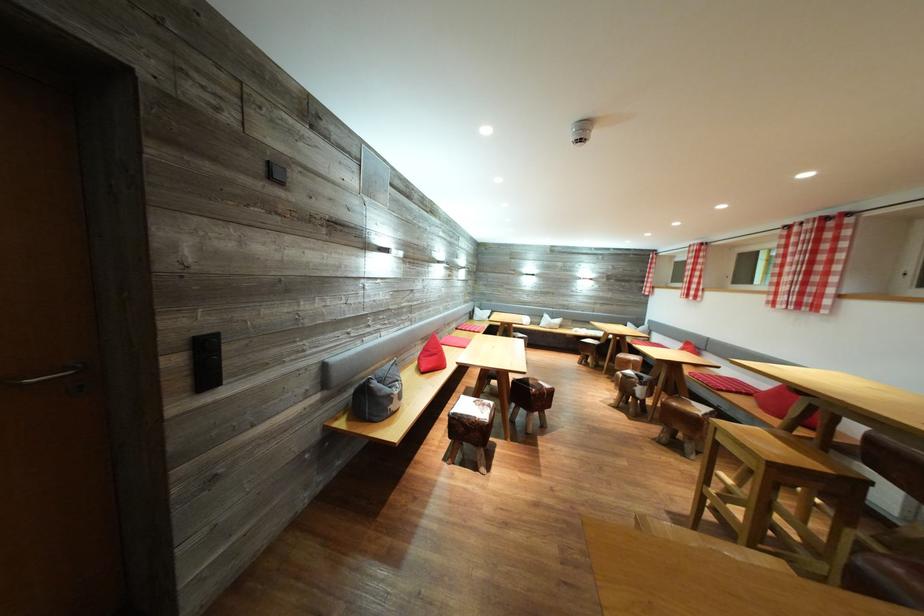
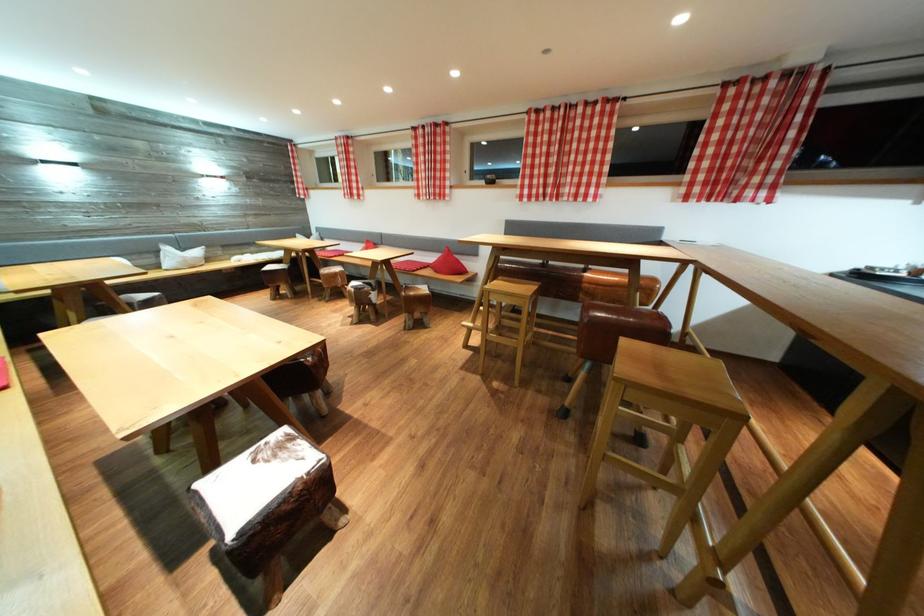
Where in the second image is the point corresponding to (553,322) from the first image?

(176, 254)